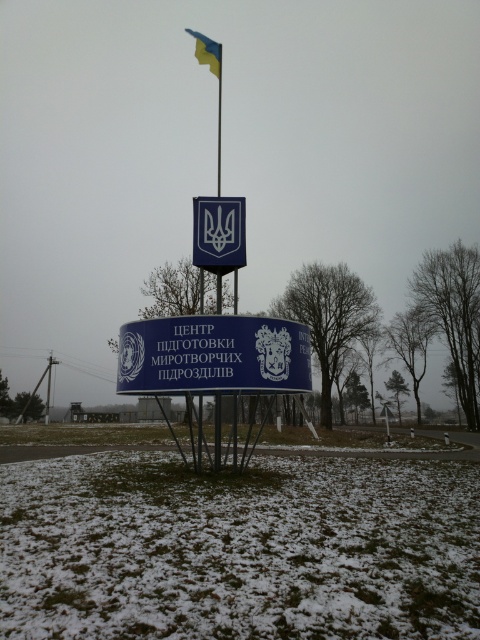
You are a tourist standing in front of the monument. You want to take a photo of the blue plastic sign at center without the blue fabric flag at upper center appearing in the frame. Is this possible?

The blue plastic sign at center is positioned under the blue fabric flag at upper center, so if you angle your camera downward to focus on the sign, you can exclude the flag from the photo.

You are standing in front of the monument and want to take a photo. You notice two points marked on the monument at coordinates point (196, 321) and point (240, 230). Which point will appear larger in your photo?

Point (196, 321) will appear larger in the photo because it is closer to the camera than point (240, 230).